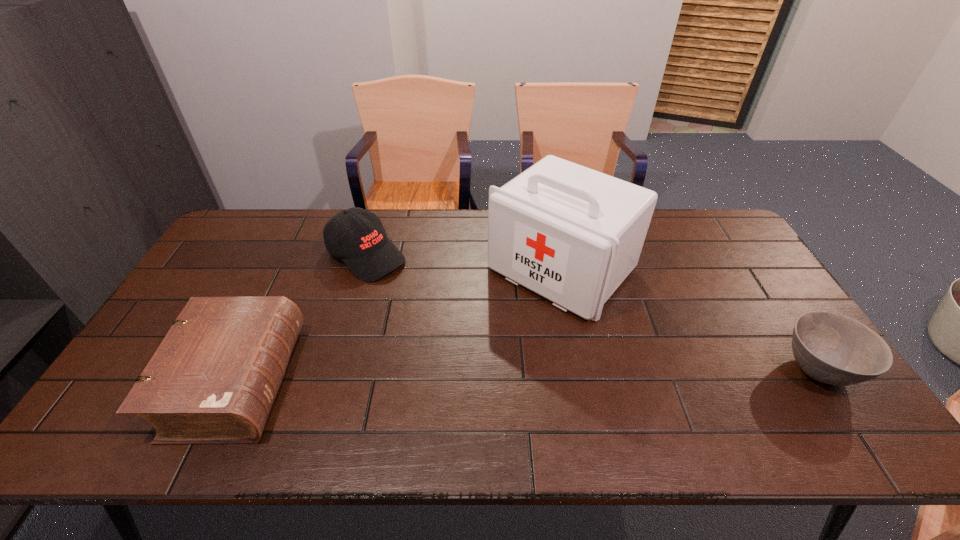
I want to click on object that is at the near left corner, so click(213, 380).

Find the location of a particular element. This screenshot has height=540, width=960. object present at the near right corner is located at coordinates (831, 348).

In the image, there is a desktop. At what (x,y) coordinates should I click in order to perform the action: click on free region at the far edge. Please return your answer as a coordinate pair (x, y). Image resolution: width=960 pixels, height=540 pixels. Looking at the image, I should click on (427, 245).

Locate an element on the screen. vacant space at the near edge of the desktop is located at coordinates (471, 375).

Locate an element on the screen. The width and height of the screenshot is (960, 540). blank area at the left edge is located at coordinates (212, 282).

In the image, there is a desktop. At what (x,y) coordinates should I click in order to perform the action: click on vacant area at the right edge. Please return your answer as a coordinate pair (x, y). Looking at the image, I should click on (725, 278).

Find the location of a particular element. vacant space that's between the Bible and the second object from right to left is located at coordinates (399, 326).

The height and width of the screenshot is (540, 960). I want to click on free area in between the Bible and the tallest object, so click(399, 326).

Image resolution: width=960 pixels, height=540 pixels. In order to click on vacant point located between the baseball cap and the third object from left to right in this screenshot , I will do `click(464, 263)`.

At what (x,y) coordinates should I click in order to perform the action: click on free space between the baseball cap and the first-aid kit. Please return your answer as a coordinate pair (x, y). This screenshot has height=540, width=960. Looking at the image, I should click on (464, 263).